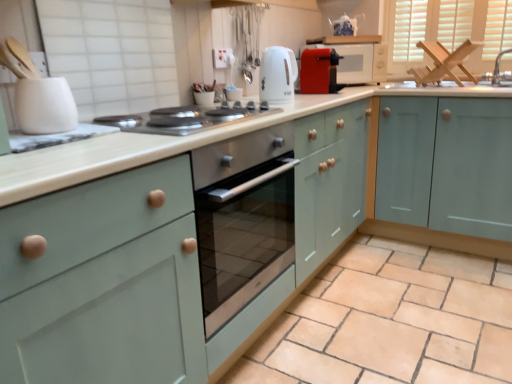
This screenshot has width=512, height=384. Identify the location of vacant area that is in front of white glossy electric kettle at upper center, the second kitchen appliance positioned from the bottom. (281, 106).